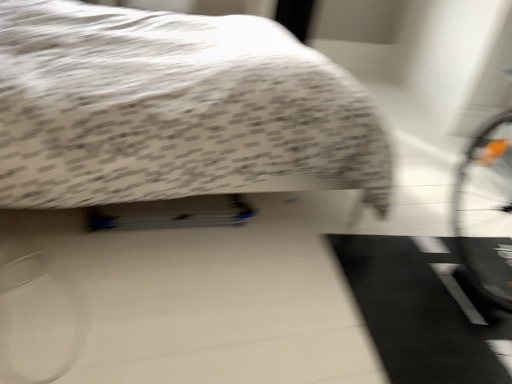
Question: Is black rubber doormat at lower right smaller than white textured bed at upper center?

Choices:
 (A) yes
 (B) no

Answer: (A)

Question: Is black rubber doormat at lower right aimed at white textured bed at upper center?

Choices:
 (A) no
 (B) yes

Answer: (A)

Question: Considering the relative sizes of black rubber doormat at lower right and white textured bed at upper center in the image provided, is black rubber doormat at lower right bigger than white textured bed at upper center?

Choices:
 (A) yes
 (B) no

Answer: (B)

Question: Is black rubber doormat at lower right beside white textured bed at upper center?

Choices:
 (A) no
 (B) yes

Answer: (A)

Question: Does black rubber doormat at lower right have a lesser height compared to white textured bed at upper center?

Choices:
 (A) no
 (B) yes

Answer: (B)

Question: Is black rubber doormat at lower right taller than white textured bed at upper center?

Choices:
 (A) yes
 (B) no

Answer: (B)

Question: Can you confirm if white textured bed at upper center is wider than black rubber doormat at lower right?

Choices:
 (A) yes
 (B) no

Answer: (A)

Question: Is white textured bed at upper center at the right side of black rubber doormat at lower right?

Choices:
 (A) no
 (B) yes

Answer: (A)

Question: Is white textured bed at upper center next to black rubber doormat at lower right and touching it?

Choices:
 (A) yes
 (B) no

Answer: (B)

Question: Is white textured bed at upper center far away from black rubber doormat at lower right?

Choices:
 (A) no
 (B) yes

Answer: (A)

Question: Does white textured bed at upper center appear on the left side of black rubber doormat at lower right?

Choices:
 (A) no
 (B) yes

Answer: (B)

Question: Is white textured bed at upper center bigger than black rubber doormat at lower right?

Choices:
 (A) no
 (B) yes

Answer: (B)

Question: From the image's perspective, is white textured bed at upper center located above or below black rubber doormat at lower right?

Choices:
 (A) above
 (B) below

Answer: (A)